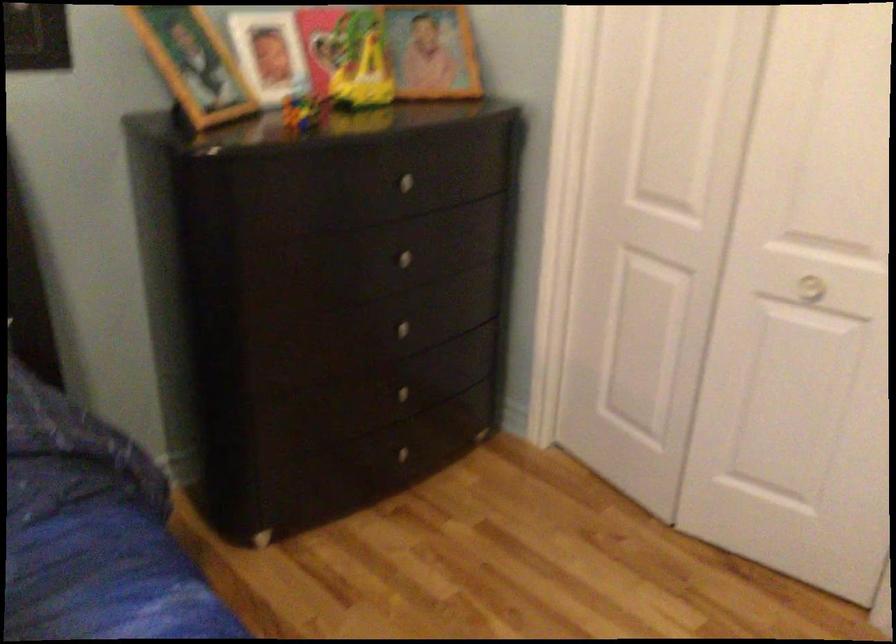
What are the coordinates of `small puzzle cube` in the screenshot? It's located at (303, 111).